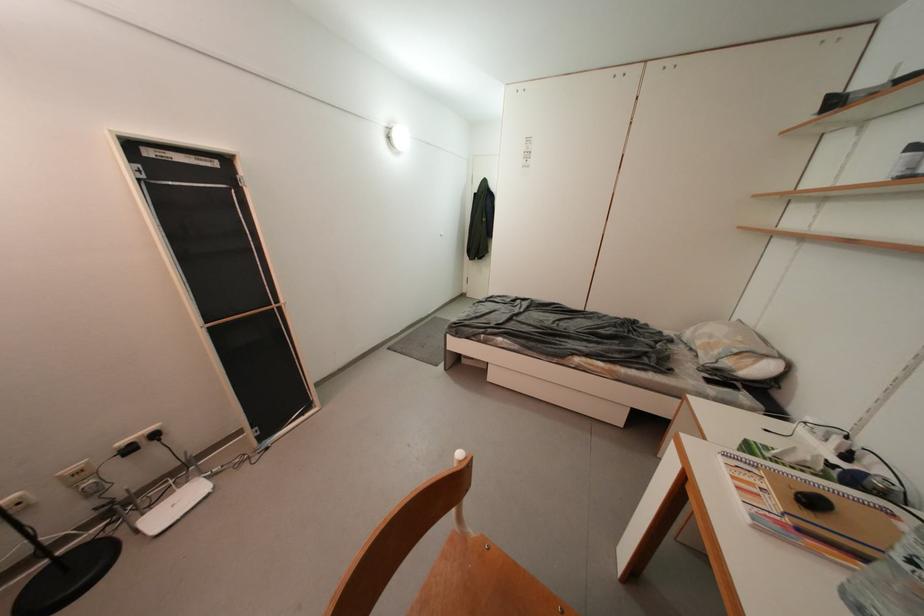
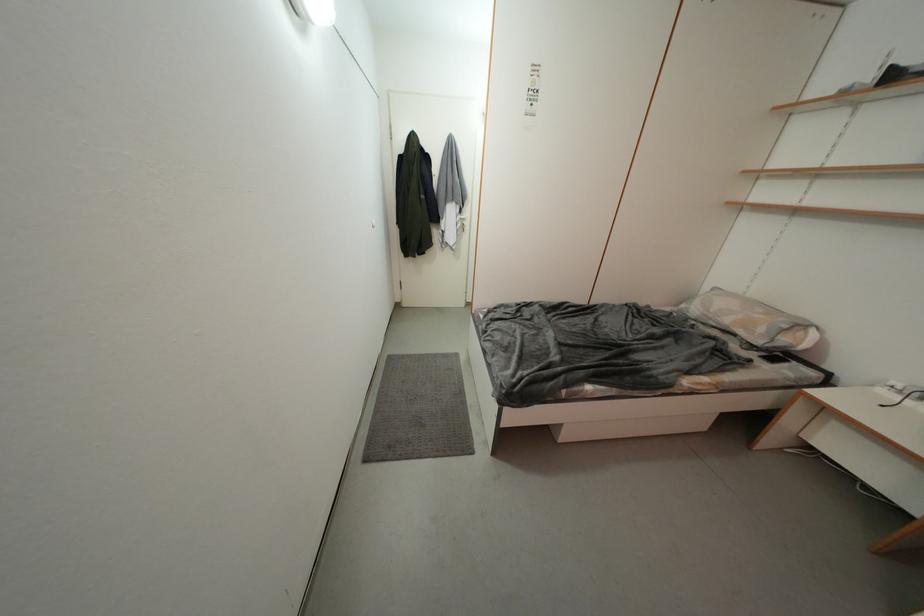
In the second image, find the point that corresponds to (723,355) in the first image.

(769, 333)